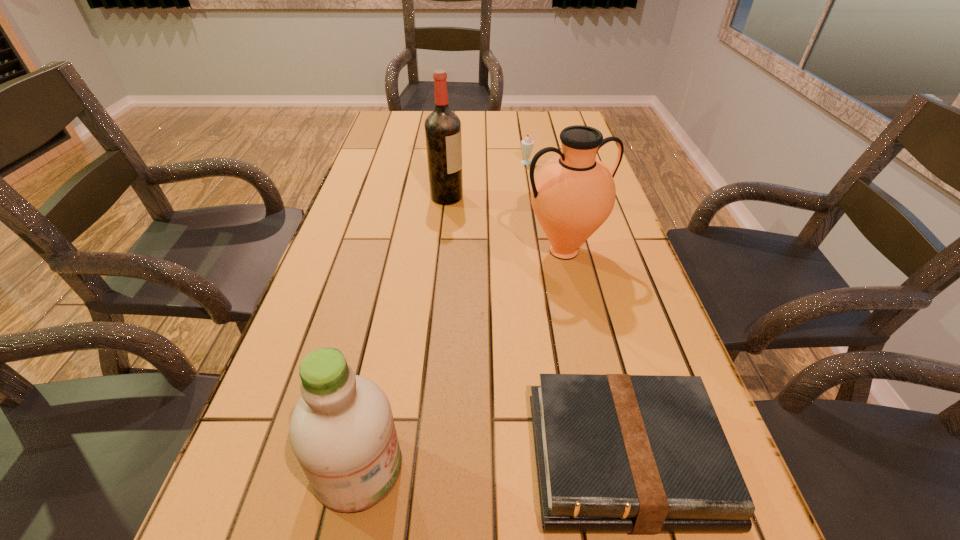
Where is `object present at the left edge`? The height and width of the screenshot is (540, 960). object present at the left edge is located at coordinates (342, 432).

Locate an element on the screen. This screenshot has height=540, width=960. pitcher at the right edge is located at coordinates (573, 194).

At what (x,y) coordinates should I click in order to perform the action: click on hardback book that is positioned at the right edge. Please return your answer as a coordinate pair (x, y). This screenshot has height=540, width=960. Looking at the image, I should click on (641, 454).

Identify the location of vacant space at the far edge of the desktop. The height and width of the screenshot is (540, 960). (530, 133).

The height and width of the screenshot is (540, 960). I want to click on blank space at the left edge, so click(x=357, y=371).

Where is `free point at the right edge`? free point at the right edge is located at coordinates (618, 278).

You are a GUI agent. You are given a task and a screenshot of the screen. Output one action in this format:
    pyautogui.click(x=<x>, y=<y>)
    Task: Click on the vacant space at the far left corner of the desktop
    This screenshot has height=540, width=960.
    Given the screenshot: What is the action you would take?
    tap(383, 119)

This screenshot has width=960, height=540. I want to click on free space at the far right corner, so click(550, 114).

Where is `empty space between the farthest object and the fourth nearest object`? The image size is (960, 540). empty space between the farthest object and the fourth nearest object is located at coordinates 488,180.

Identify the location of vacant space that's between the third tallest object and the third farthest object. This screenshot has width=960, height=540. (461, 360).